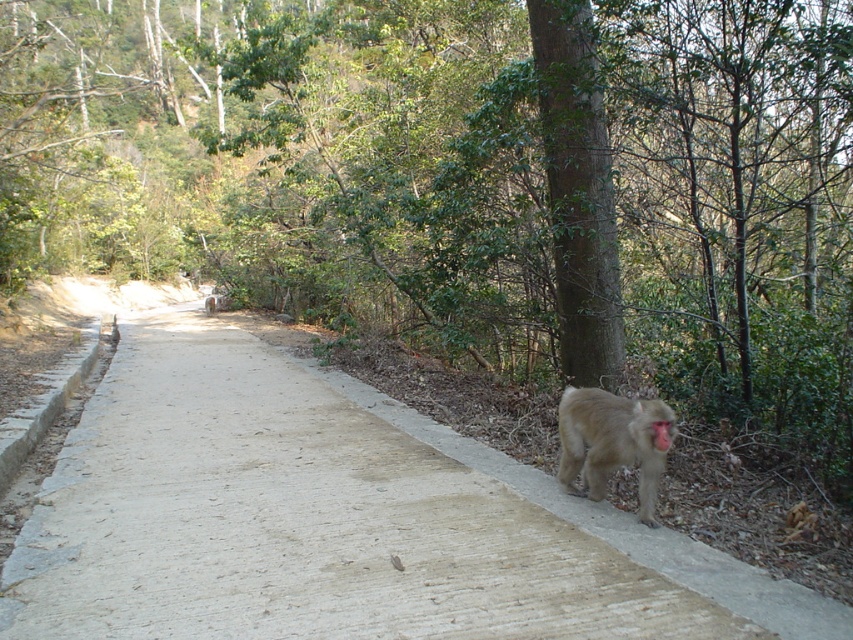
Question: Which is farther from the pink fur monkey at lower right?

Choices:
 (A) gray fur monkey at lower right
 (B) gray concrete pavement at center

Answer: (B)

Question: Does gray fur monkey at lower right appear under pink fur monkey at lower right?

Choices:
 (A) yes
 (B) no

Answer: (A)

Question: Is gray concrete pavement at center closer to camera compared to gray fur monkey at lower right?

Choices:
 (A) no
 (B) yes

Answer: (B)

Question: Can you confirm if gray fur monkey at lower right is positioned above pink fur monkey at lower right?

Choices:
 (A) yes
 (B) no

Answer: (B)

Question: Which of these objects is positioned farthest from the gray fur monkey at lower right?

Choices:
 (A) pink fur monkey at lower right
 (B) gray concrete pavement at center

Answer: (B)

Question: Estimate the real-world distances between objects in this image. Which object is closer to the gray concrete pavement at center?

Choices:
 (A) pink fur monkey at lower right
 (B) gray fur monkey at lower right

Answer: (B)